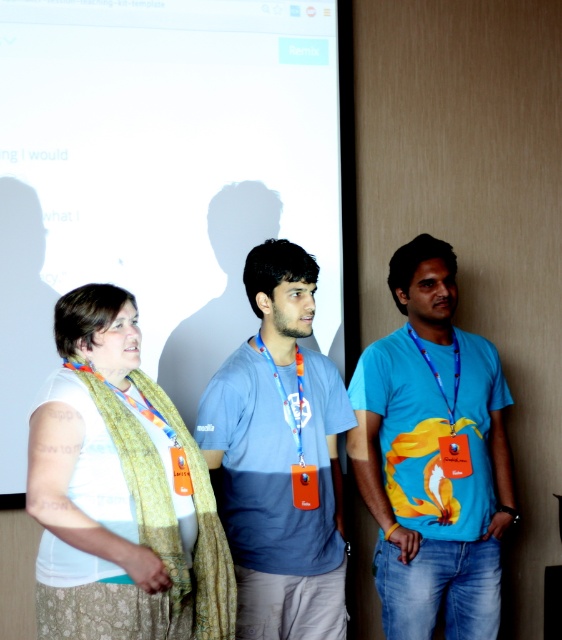
From the picture: You are standing in the conference room and see the point marked at coordinate (432, 456). Which object is this point located on?

The point marked at coordinate (432, 456) is located on the blue printed t shirt at center.